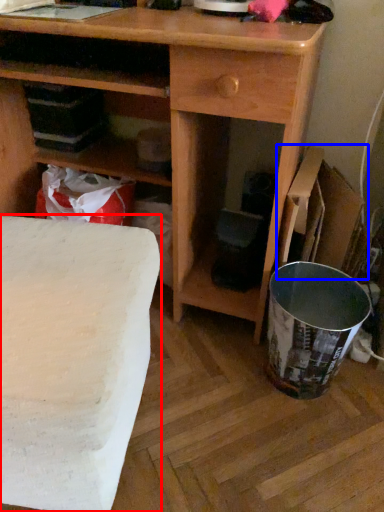
Question: Which of the following is the farthest to the observer, table (highlighted by a red box) or cardboard box (highlighted by a blue box)?

Choices:
 (A) table
 (B) cardboard box

Answer: (B)